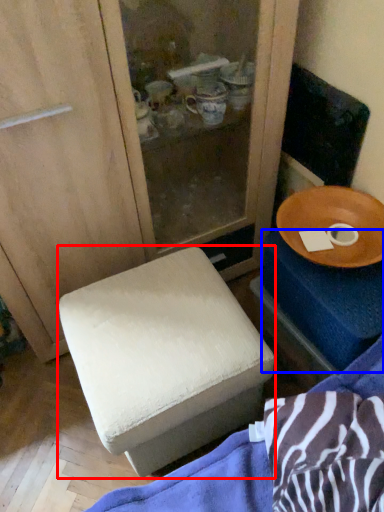
Question: Which object appears closest to the camera in this image, furniture (highlighted by a red box) or changing table (highlighted by a blue box)?

Choices:
 (A) furniture
 (B) changing table

Answer: (A)